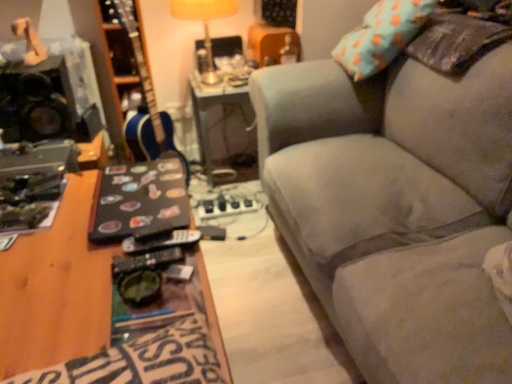
Question: From the image's perspective, is metallic silver table at center positioned above or below teal fabric pillow at upper right?

Choices:
 (A) above
 (B) below

Answer: (B)

Question: In terms of size, does metallic silver table at center appear bigger or smaller than teal fabric pillow at upper right?

Choices:
 (A) small
 (B) big

Answer: (B)

Question: Which object is positioned farthest from the velvet gray couch at right?

Choices:
 (A) blue glossy guitar at center
 (B) teal fabric pillow at upper right
 (C) metallic silver table at center
 (D) yellow fabric lampshade at upper center
 (E) black matte speaker at left

Answer: (E)

Question: Which object is the farthest from the teal fabric pillow at upper right?

Choices:
 (A) velvet gray couch at right
 (B) metallic silver table at center
 (C) black matte speaker at left
 (D) blue glossy guitar at center
 (E) yellow fabric lampshade at upper center

Answer: (C)